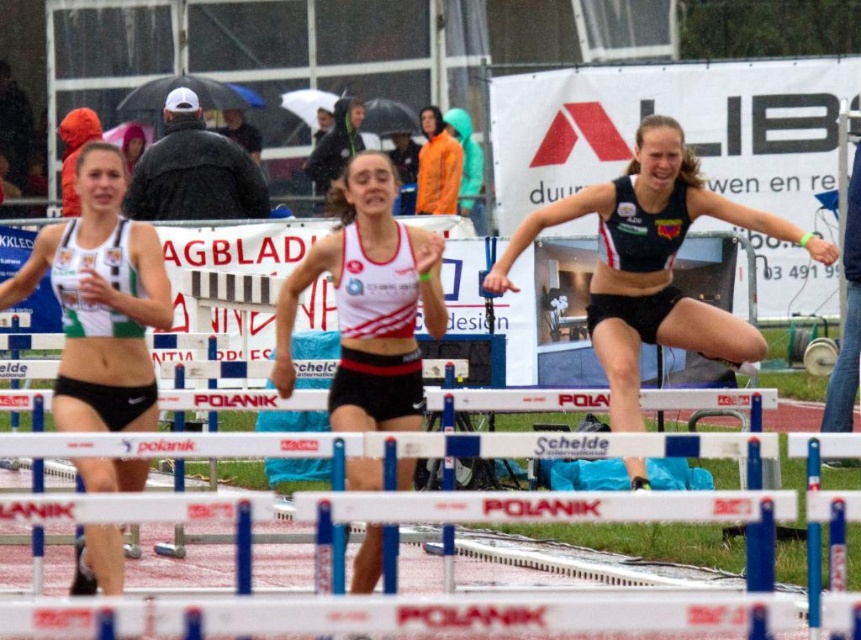
Who is positioned more to the right, green and white athletic top at left or orange nylon jacket at upper center?

orange nylon jacket at upper center is more to the right.

Does green and white athletic top at left appear under orange nylon jacket at upper center?

Yes, green and white athletic top at left is below orange nylon jacket at upper center.

Is point (78, 218) positioned before point (454, 202)?

Yes, it is in front of point (454, 202).

Where is `green and white athletic top at left`? green and white athletic top at left is located at coordinates (101, 301).

Which is above, white plastic hurdle at center or green and white athletic top at left?

green and white athletic top at left is above.

Who is shorter, white plastic hurdle at center or green and white athletic top at left?

With less height is white plastic hurdle at center.

The image size is (861, 640). In order to click on white plastic hurdle at center in this screenshot , I will do `click(578, 492)`.

Identify the location of white plastic hurdle at center. This screenshot has width=861, height=640. (578, 492).

Can you confirm if white plastic hurdle at center is shorter than matte black shorts at center?

Yes.

Which is more to the right, white plastic hurdle at center or matte black shorts at center?

matte black shorts at center is more to the right.

Image resolution: width=861 pixels, height=640 pixels. Identify the location of white plastic hurdle at center. (578, 492).

Where is `white plastic hurdle at center`? This screenshot has width=861, height=640. white plastic hurdle at center is located at coordinates (578, 492).